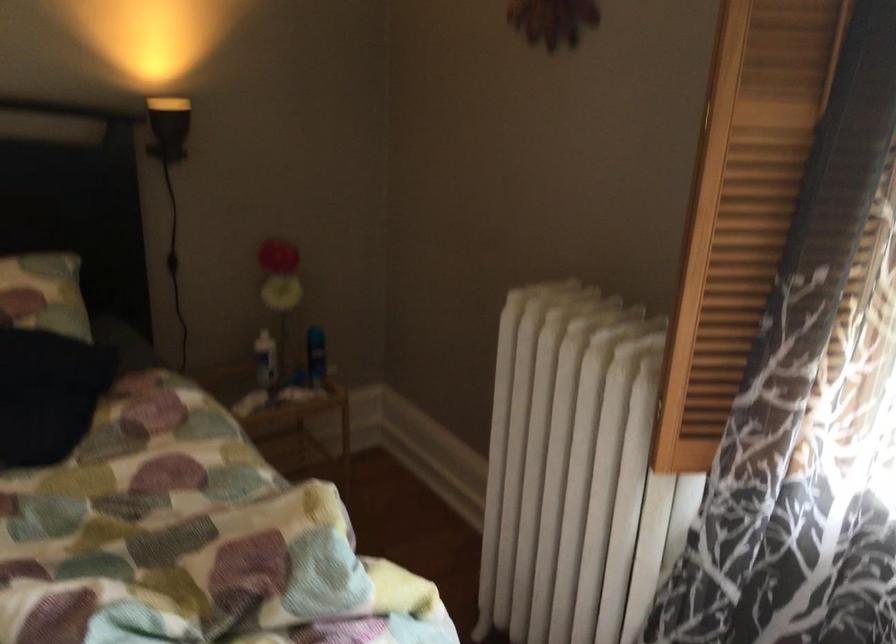
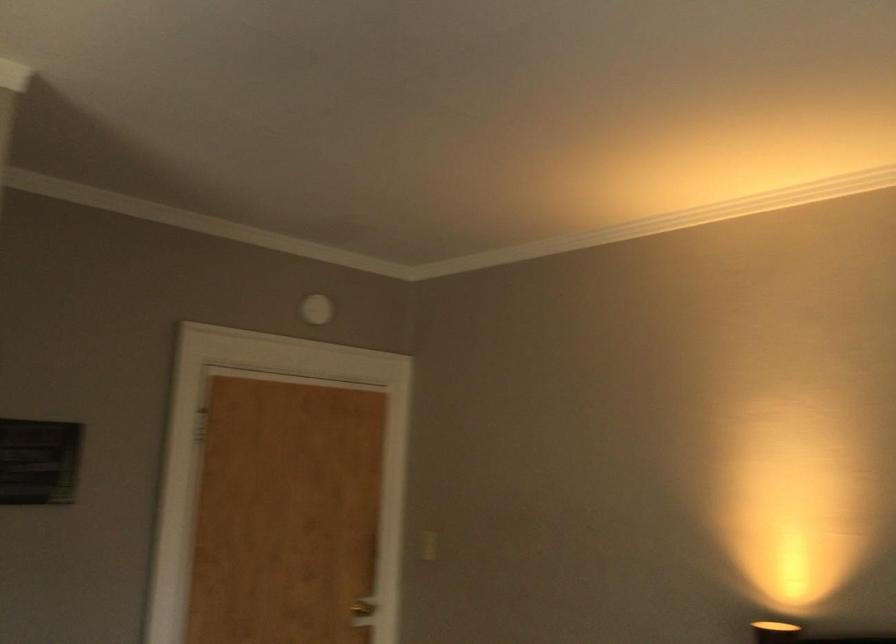
First-person continuous shooting, in which direction is the camera rotating?

The rotation direction of the camera is left-up.